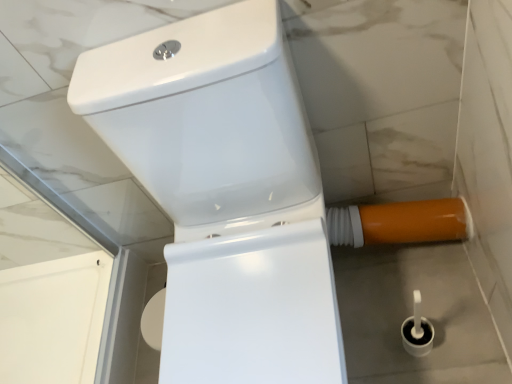
In order to face white glossy toilet at center, should I rotate leftwards or rightwards?

Rotate left and turn 1.486 degrees.

What do you see at coordinates (225, 193) in the screenshot?
I see `white glossy toilet at center` at bounding box center [225, 193].

Find the location of a particular element. This screenshot has height=384, width=512. white glossy toilet at center is located at coordinates (225, 193).

This screenshot has height=384, width=512. Find the location of `orange glossy water pipe at lower right`. orange glossy water pipe at lower right is located at coordinates (399, 222).

The width and height of the screenshot is (512, 384). What do you see at coordinates (399, 222) in the screenshot? I see `orange glossy water pipe at lower right` at bounding box center [399, 222].

Where is `white glossy toilet at center`? white glossy toilet at center is located at coordinates (225, 193).

Which object is positioned more to the left, orange glossy water pipe at lower right or white glossy toilet at center?

Positioned to the left is white glossy toilet at center.

In the image, is orange glossy water pipe at lower right positioned in front of or behind white glossy toilet at center?

Clearly, orange glossy water pipe at lower right is behind white glossy toilet at center.

Is point (415, 211) more distant than point (90, 87)?

Yes, it is.

From the image's perspective, is orange glossy water pipe at lower right located beneath white glossy toilet at center?

Incorrect, from the image's perspective, orange glossy water pipe at lower right is higher than white glossy toilet at center.

From a real-world perspective, is orange glossy water pipe at lower right above or below white glossy toilet at center?

orange glossy water pipe at lower right is below white glossy toilet at center.

Considering the sizes of objects orange glossy water pipe at lower right and white glossy toilet at center in the image provided, who is thinner, orange glossy water pipe at lower right or white glossy toilet at center?

orange glossy water pipe at lower right is thinner.

Considering the sizes of objects orange glossy water pipe at lower right and white glossy toilet at center in the image provided, who is shorter, orange glossy water pipe at lower right or white glossy toilet at center?

With less height is orange glossy water pipe at lower right.

Who is smaller, orange glossy water pipe at lower right or white glossy toilet at center?

orange glossy water pipe at lower right.

Is orange glossy water pipe at lower right completely or partially outside of white glossy toilet at center?

orange glossy water pipe at lower right lies outside white glossy toilet at center's area.

Is orange glossy water pipe at lower right with white glossy toilet at center?

They are not placed beside each other.

In the scene shown: Could you tell me if orange glossy water pipe at lower right is facing white glossy toilet at center?

No, orange glossy water pipe at lower right is not turned towards white glossy toilet at center.

What's the angular difference between orange glossy water pipe at lower right and white glossy toilet at center's facing directions?

There is a 0.00213-degree angle between the facing directions of orange glossy water pipe at lower right and white glossy toilet at center.

Measure the distance between orange glossy water pipe at lower right and white glossy toilet at center.

16.74 inches.

Find the location of a particular element. water pipe that is on the right side of white glossy toilet at center is located at coordinates tap(399, 222).

Based on the photo, based on their positions, is white glossy toilet at center located to the left or right of orange glossy water pipe at lower right?

In the image, white glossy toilet at center appears on the left side of orange glossy water pipe at lower right.

Does white glossy toilet at center lie in front of orange glossy water pipe at lower right?

Yes, white glossy toilet at center is closer to the viewer.

Does point (245, 214) come behind point (430, 209)?

No, it is in front of (430, 209).

From the image's perspective, is white glossy toilet at center positioned above or below orange glossy water pipe at lower right?

From the image's perspective, white glossy toilet at center appears below orange glossy water pipe at lower right.

From a real-world perspective, is white glossy toilet at center under orange glossy water pipe at lower right?

No.

Which of these two, white glossy toilet at center or orange glossy water pipe at lower right, is wider?

white glossy toilet at center.

Does white glossy toilet at center have a greater height compared to orange glossy water pipe at lower right?

Correct, white glossy toilet at center is much taller as orange glossy water pipe at lower right.

Is white glossy toilet at center bigger or smaller than orange glossy water pipe at lower right?

Considering their sizes, white glossy toilet at center takes up more space than orange glossy water pipe at lower right.

Is orange glossy water pipe at lower right surrounded by white glossy toilet at center?

No, orange glossy water pipe at lower right is not inside white glossy toilet at center.

Are white glossy toilet at center and orange glossy water pipe at lower right beside each other?

No, white glossy toilet at center is not touching orange glossy water pipe at lower right.

Is orange glossy water pipe at lower right at the back of white glossy toilet at center?

No, white glossy toilet at center's orientation is not away from orange glossy water pipe at lower right.

How many degrees apart are the facing directions of white glossy toilet at center and orange glossy water pipe at lower right?

white glossy toilet at center and orange glossy water pipe at lower right are facing 0.00213 degrees away from each other.

Where is `toilet on the left of orange glossy water pipe at lower right`? The width and height of the screenshot is (512, 384). toilet on the left of orange glossy water pipe at lower right is located at coordinates (225, 193).

You are a GUI agent. You are given a task and a screenshot of the screen. Output one action in this format:
    pyautogui.click(x=<x>, y=<y>)
    Task: Click on the water pipe above the white glossy toilet at center (from the image's perspective)
    
    Given the screenshot: What is the action you would take?
    pyautogui.click(x=399, y=222)

In the image, there is a orange glossy water pipe at lower right. Identify the location of toilet below it (from the image's perspective). click(225, 193).